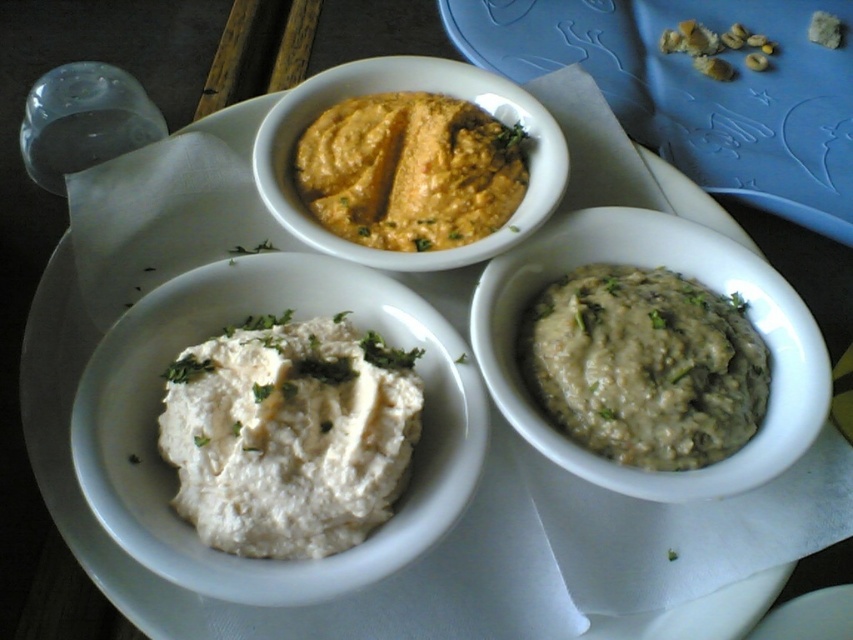
You are arranging snacks for a party and notice the white creamy dip at center and the white matte bowl at lower right. Which one is located to the left of the other?

The white creamy dip at center is positioned on the left side of white matte bowl at lower right.

You are a food stylist trying to arrange these dips for a photo shoot. You need to position the white matte hummus at lower left exactly 30 inches away from the viewer to ensure proper lighting. Based on the current setup, is the hummus bowl too close or too far?

The white matte hummus at lower left is currently 31.05 inches away from the viewer, which is slightly farther than the desired 30 inches. To achieve the correct positioning, you should move it 1.05 inches closer to the viewer.